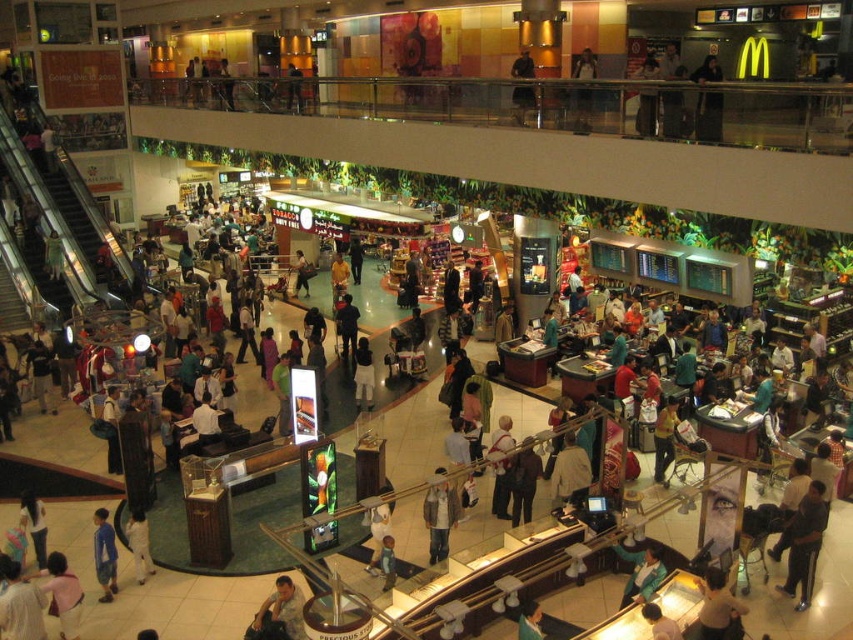
Between light brown leather jacket at lower center and white matte dress at center, which one is positioned lower?

light brown leather jacket at lower center is below.

How far apart are light brown leather jacket at lower center and white matte dress at center?

light brown leather jacket at lower center and white matte dress at center are 42.34 feet apart.

Image resolution: width=853 pixels, height=640 pixels. Identify the location of light brown leather jacket at lower center. (282, 609).

Is point (808, 598) farther from viewer compared to point (296, 589)?

Yes.

Does point (799, 547) come in front of point (293, 628)?

No, (799, 547) is further to viewer.

Where is `dark blue jeans at center`? dark blue jeans at center is located at coordinates (804, 544).

Is light brown leather jacket at lower center smaller than green fabric bag at lower center?

No, light brown leather jacket at lower center is not smaller than green fabric bag at lower center.

Is point (283, 612) farther from camera compared to point (537, 632)?

Yes, it is.

Who is more forward, (289, 609) or (540, 612)?

Point (540, 612) is in front.

Find the location of a particular element. Image resolution: width=853 pixels, height=640 pixels. light brown leather jacket at lower center is located at coordinates (282, 609).